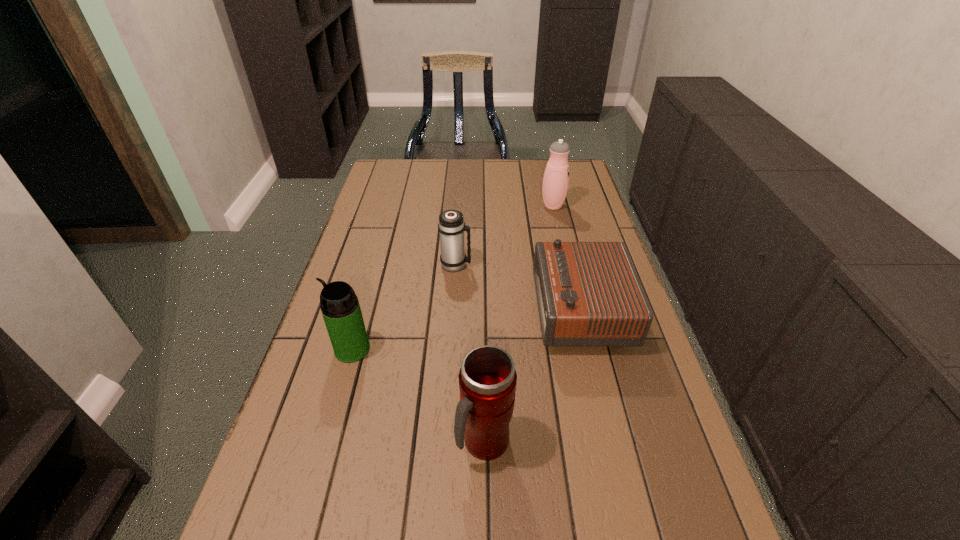
In order to click on free space located 0.050m from the spout of the leftmost thermos bottle in this screenshot , I will do `click(314, 349)`.

This screenshot has height=540, width=960. I want to click on free point located 0.060m on the side with the handle of the second farthest thermos bottle, so click(x=492, y=265).

At what (x,y) coordinates should I click in order to perform the action: click on free location located on the front panel of the radio receiver. Please return your answer as a coordinate pair (x, y). The width and height of the screenshot is (960, 540). Looking at the image, I should click on (493, 310).

Where is `vacant area situated on the front panel of the radio receiver`? Image resolution: width=960 pixels, height=540 pixels. vacant area situated on the front panel of the radio receiver is located at coordinates (482, 310).

You are a GUI agent. You are given a task and a screenshot of the screen. Output one action in this format:
    pyautogui.click(x=<x>, y=<y>)
    Task: Click on the free region located 0.170m on the front panel of the radio receiver
    This screenshot has width=960, height=540.
    Given the screenshot: What is the action you would take?
    pyautogui.click(x=470, y=310)

Find the location of `object that is positioned at the left edge`. object that is positioned at the left edge is located at coordinates (341, 311).

Where is `thermos bottle present at the right edge`? thermos bottle present at the right edge is located at coordinates (555, 184).

At what (x,y) coordinates should I click in order to perform the action: click on radio receiver that is at the right edge. Please return your answer as a coordinate pair (x, y). Looking at the image, I should click on (588, 293).

Find the location of a particular element. This screenshot has height=540, width=960. vacant space at the far edge of the desktop is located at coordinates (517, 178).

Image resolution: width=960 pixels, height=540 pixels. In order to click on vacant area at the left edge in this screenshot , I will do `click(320, 330)`.